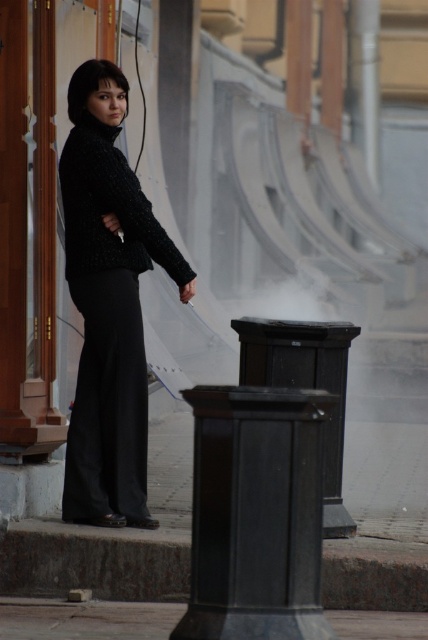
You are a delivery person trying to place a small white package on the ground. You see the black glossy trash can at lower right and the smooth concrete pavement at lower center. Which surface should you choose to place the package so it stays visible and not blocked by the trash can?

You should place the package on the smooth concrete pavement at lower center because the black glossy trash can at lower right is positioned on the right side of it, so placing it there keeps it visible and unobstructed.

You are a city planner analyzing the urban scene. The coordinates given are in a normalized system where the bottom left corner is the origin. If the matte black sweater at center is at point 0.477, 0.255, what direction is it relative to the bottom left corner?

The matte black sweater at center is located at coordinates 0.477 on the x axis and 0.255 on the y axis. Since the bottom left corner is the origin, the sweater is northeast of the bottom left corner because it has a higher x and y value than the origin.

You are a delivery person trying to place a small white package in the correct location. The package must be placed at the point with coordinates point (x=255, y=515). Based on the scene, where should you place the package?

The point (x=255, y=515) corresponds to the location of the black glossy trash can at lower right, so you should place the package near the black glossy trash can at lower right.